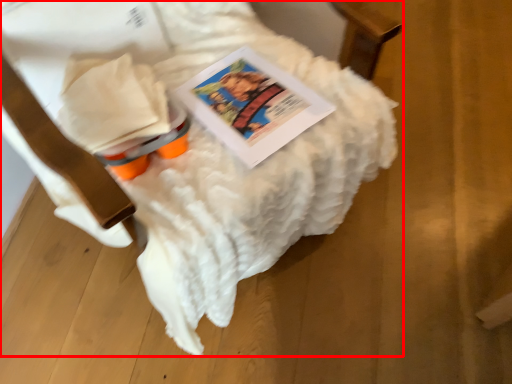
Question: From the image's perspective, considering the relative positions of furniture (annotated by the red box) and book in the image provided, where is furniture (annotated by the red box) located with respect to the staircase?

Choices:
 (A) below
 (B) above

Answer: (B)